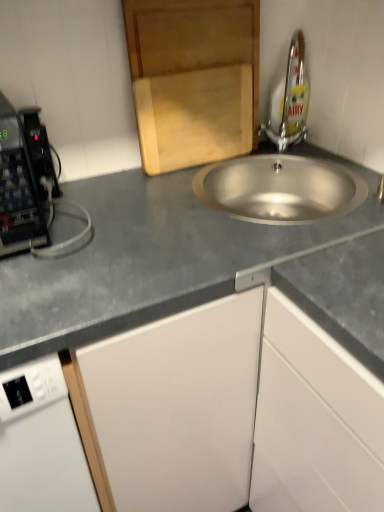
Question: From a real-world perspective, is stainless steel sink at center physically located above or below white matte cabinet at lower right, the second cabinetry viewed from the top?

Choices:
 (A) below
 (B) above

Answer: (B)

Question: Is stainless steel sink at center inside or outside of white matte cabinet at lower right, the 1th cabinetry from the right?

Choices:
 (A) outside
 (B) inside

Answer: (A)

Question: Considering the real-world distances, which object is closest to the wooden cutting board at upper center, arranged as the 2th cabinetry when viewed from the right?

Choices:
 (A) gray matte countertop at center
 (B) silver metallic tap at upper right
 (C) stainless steel sink at center
 (D) white matte cabinet at lower right, the second cabinetry from the left

Answer: (B)

Question: Which of these objects is positioned closest to the white matte cabinet at lower right, the 1th cabinetry from the right?

Choices:
 (A) stainless steel sink at center
 (B) gray matte countertop at center
 (C) silver metallic tap at upper right
 (D) wooden cutting board at upper center, the 1th cabinetry positioned from the top

Answer: (B)